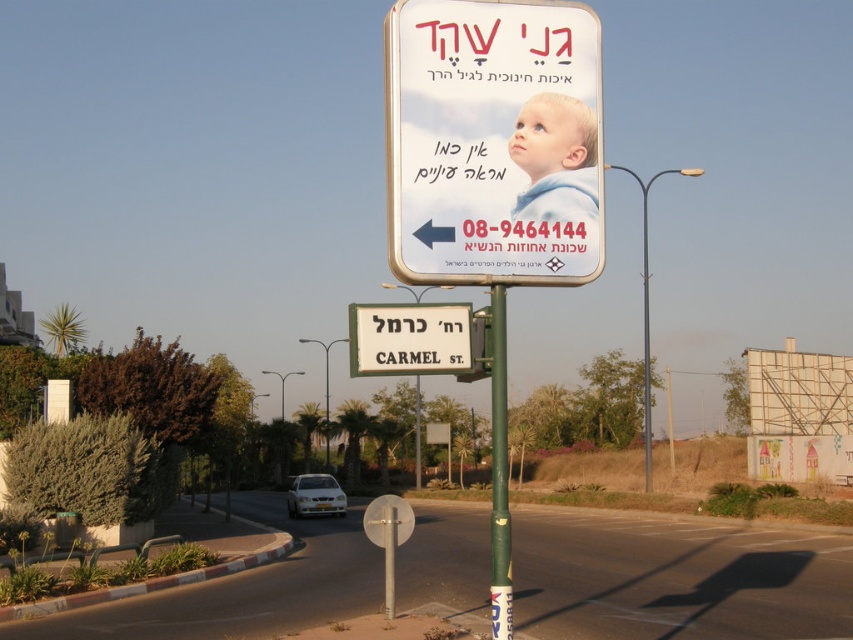
Question: Can you confirm if white plastic street sign at center is smaller than green painted metal pole at center?

Choices:
 (A) no
 (B) yes

Answer: (A)

Question: Does white plastic street sign at center have a smaller size compared to green painted metal pole at center?

Choices:
 (A) yes
 (B) no

Answer: (B)

Question: Considering the real-world distances, which object is closest to the matte plastic sign at upper center?

Choices:
 (A) green painted metal pole at center
 (B) light blue fabric baby at upper center
 (C) white plastic street sign at center

Answer: (B)

Question: Does matte plastic sign at upper center have a smaller size compared to light blue fabric baby at upper center?

Choices:
 (A) no
 (B) yes

Answer: (A)

Question: Which point is farther to the camera?

Choices:
 (A) green painted metal pole at center
 (B) matte plastic sign at upper center
 (C) white plastic street sign at center
 (D) light blue fabric baby at upper center

Answer: (C)

Question: Based on their relative distances, which object is farther from the white plastic street sign at center?

Choices:
 (A) green painted metal pole at center
 (B) matte plastic sign at upper center
 (C) light blue fabric baby at upper center

Answer: (A)